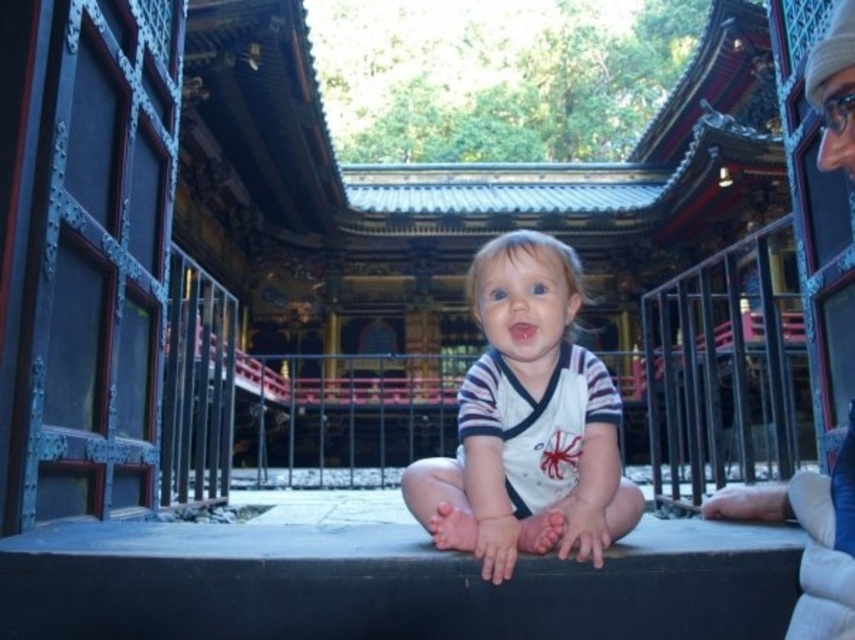
Is white cotton shirt at center taller than white knit hat at upper right?

No.

Which of these two, white cotton shirt at center or white knit hat at upper right, stands shorter?

white cotton shirt at center

You are a GUI agent. You are given a task and a screenshot of the screen. Output one action in this format:
    pyautogui.click(x=<x>, y=<y>)
    Task: Click on the white cotton shirt at center
    
    Given the screenshot: What is the action you would take?
    pyautogui.click(x=528, y=422)